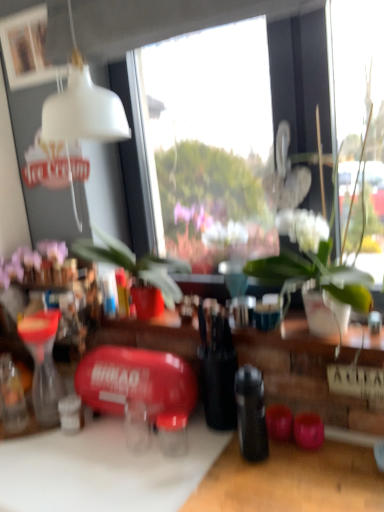
The width and height of the screenshot is (384, 512). Identify the location of free space above white matte cutting board at lower left (from a real-world perspective). (132, 462).